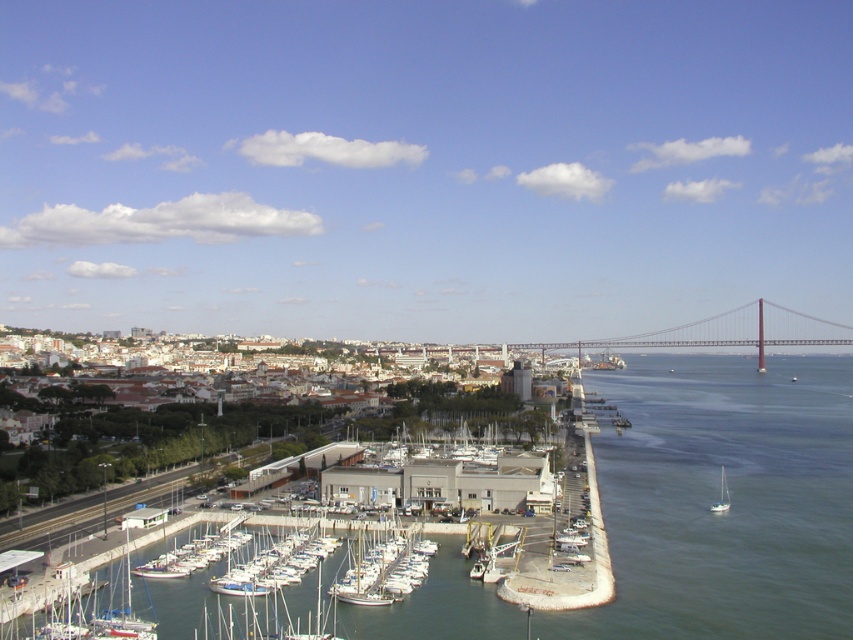
You are standing at the camera position and want to walk to the white wooden sailboat at center. The path is clear, but you have a 1 meter wide cart. Can you safely navigate to the sailboat without hitting anything?

The white wooden sailboat at center is 94.00 meters away from the camera, so there is sufficient space for you and your 1 meter wide cart to safely navigate to the sailboat without any obstructions.